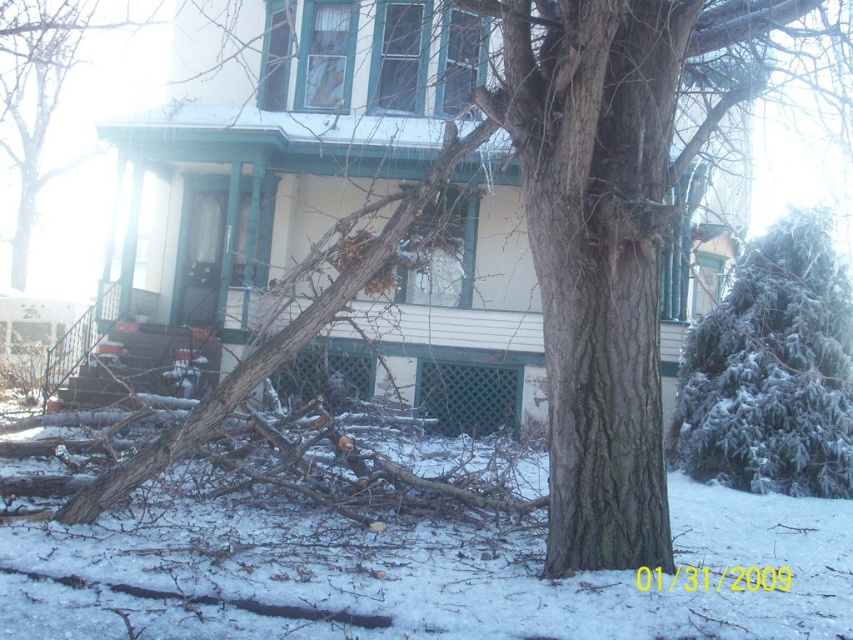
Which is behind, point (724, 429) or point (54, 211)?

The point (54, 211) is more distant.

Can you confirm if green textured evergreen at right is smaller than brown rough bark tree at upper center?

No, green textured evergreen at right is not smaller than brown rough bark tree at upper center.

Which is behind, point (816, 429) or point (115, 76)?

Point (115, 76)

Image resolution: width=853 pixels, height=640 pixels. I want to click on green textured evergreen at right, so click(770, 371).